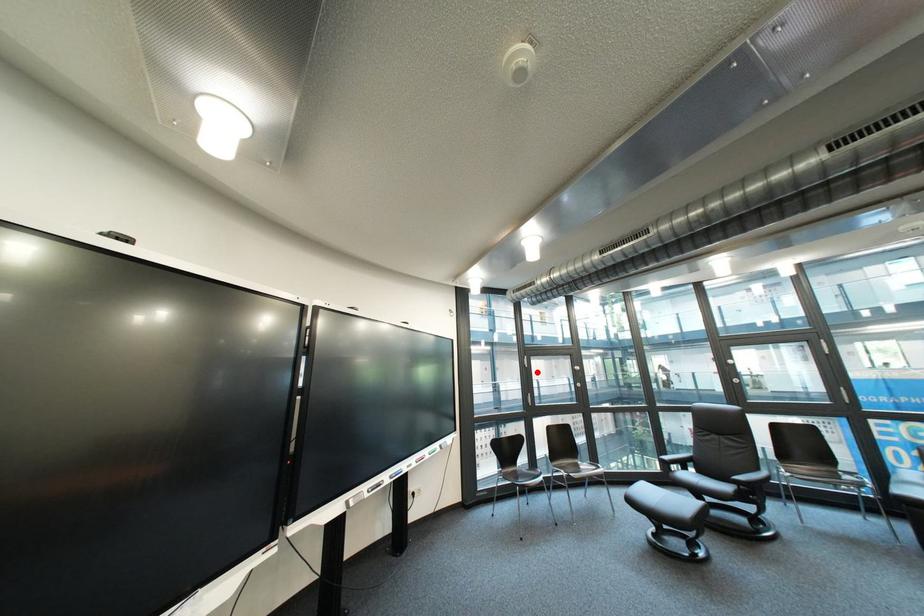
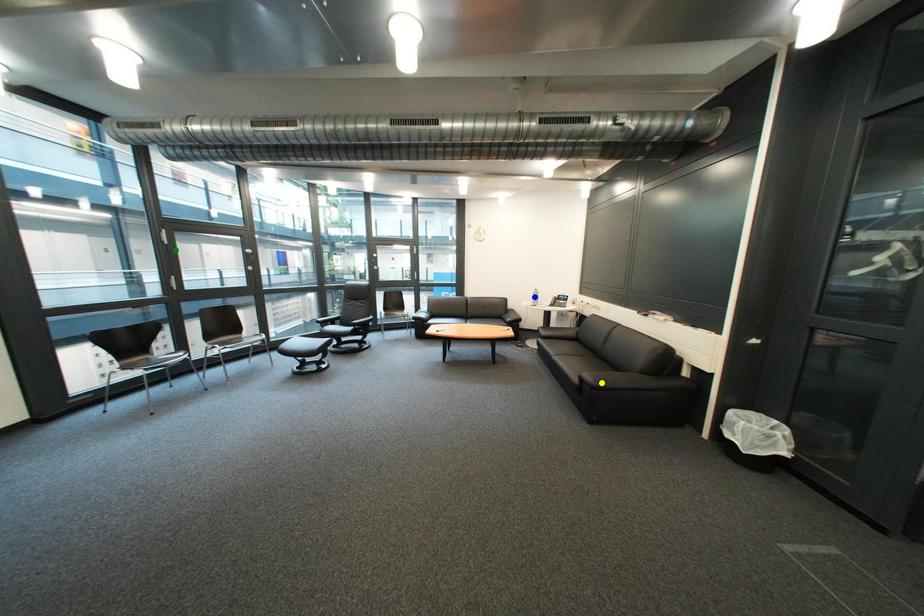
Question: I am providing you with two images of the same scene from different viewpoints. A red point is marked on the first image. You are given multiple points on the second image. Can you choose the point in image 2 that corresponds to the point in image 1?

Choices:
 (A) green point
 (B) yellow point
 (C) blue point

Answer: (A)